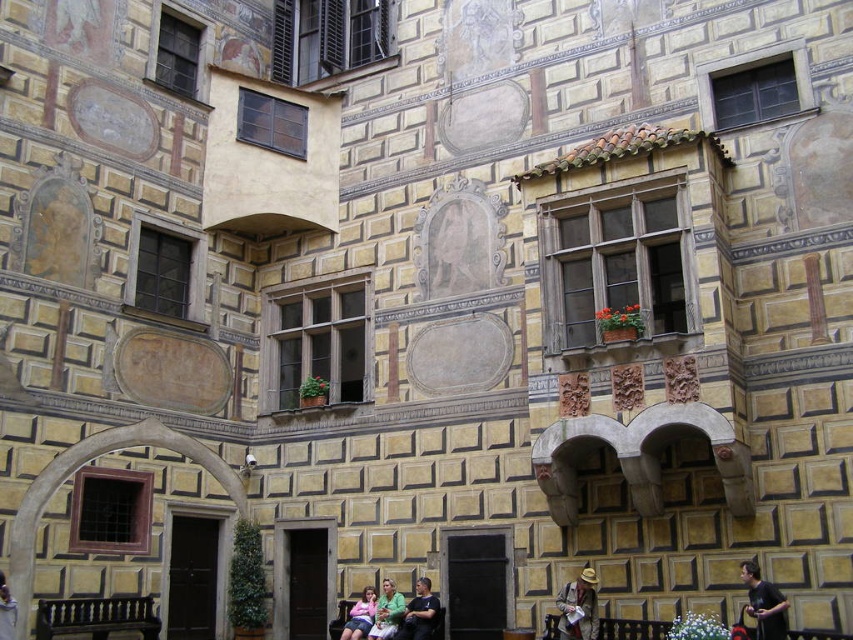
You are standing in front of the historic building and see a leather hat at center and a wooden park bench at lower center. Which object is positioned higher from the ground?

The leather hat at center is located above the wooden park bench at lower center, so it is positioned higher from the ground.

You are an artist observing the historic building and notice two shirts in the scene. Which shirt, the black fabric shirt at lower right or the matte black shirt at center, is narrower in width?

The black fabric shirt at lower right is thinner than the matte black shirt at center, so the black fabric shirt at lower right is narrower in width.

You are standing in front of the historic building and see the dark brown wood bench at lower left and the black fabric shirt at lower right. Which object is located more to the left?

The dark brown wood bench at lower left is more to the left than the black fabric shirt at lower right.